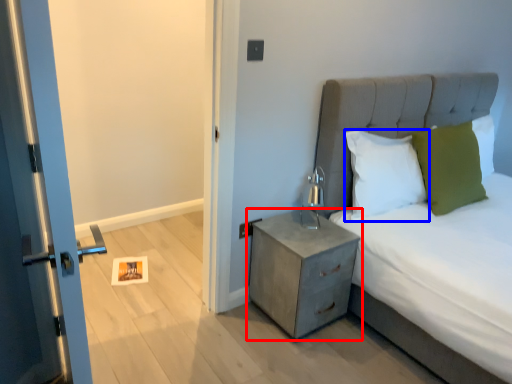
Question: Which object is further to the camera taking this photo, nightstand (highlighted by a red box) or pillow (highlighted by a blue box)?

Choices:
 (A) nightstand
 (B) pillow

Answer: (B)